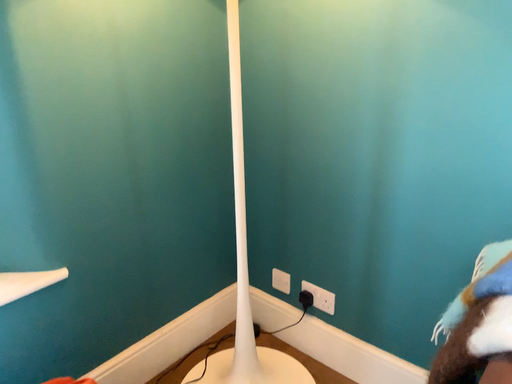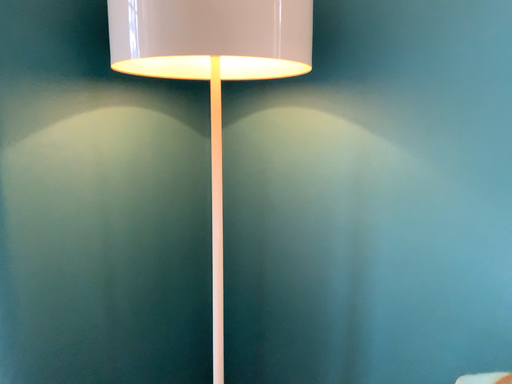
Question: How did the camera likely rotate when shooting the video?

Choices:
 (A) rotated downward
 (B) rotated upward

Answer: (B)